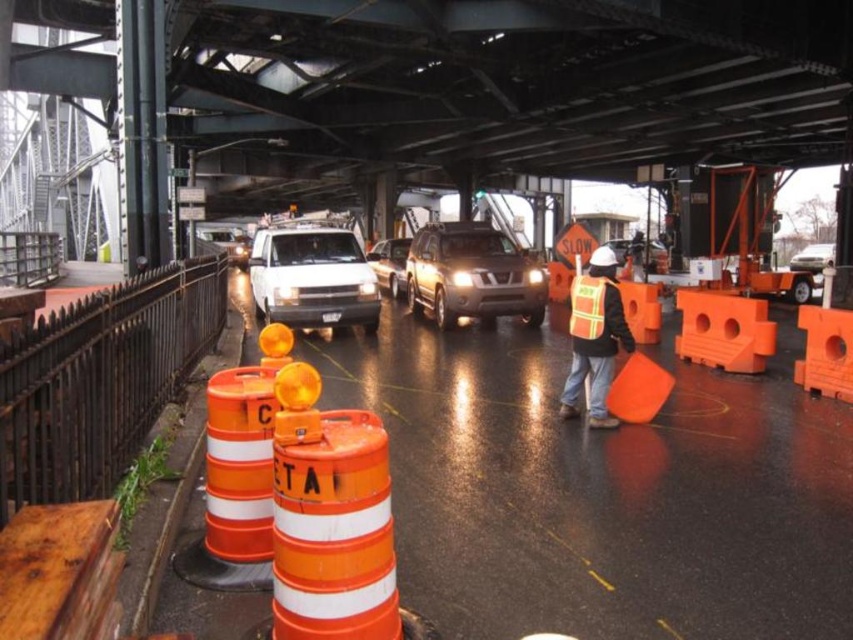
Question: Can you confirm if satin silver suv at center is positioned below white glossy sedan at center?

Choices:
 (A) no
 (B) yes

Answer: (B)

Question: Which object appears farthest from the camera in this image?

Choices:
 (A) white glossy sedan at center
 (B) white matte van at center

Answer: (A)

Question: Does orange reflective barrel at left have a lesser width compared to white glossy sedan at center?

Choices:
 (A) no
 (B) yes

Answer: (B)

Question: Which object appears farthest from the camera in this image?

Choices:
 (A) hi-visibility reflective vest at center
 (B) satin gold suv at center
 (C) satin silver suv at center

Answer: (C)

Question: Does satin gold suv at center have a larger size compared to satin silver suv at center?

Choices:
 (A) yes
 (B) no

Answer: (B)

Question: Estimate the real-world distances between objects in this image. Which object is farther from the satin gold suv at center?

Choices:
 (A) orange reflective safety vest at center
 (B) satin silver suv at center
 (C) orange reflective barrel at left

Answer: (C)